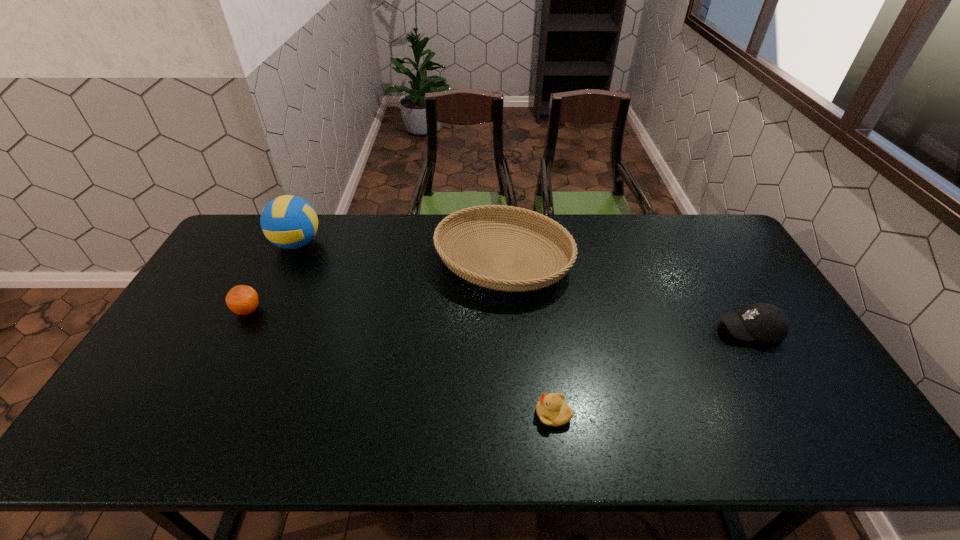
Identify the location of empty location between the tallest object and the orange. The width and height of the screenshot is (960, 540). (273, 277).

Locate an element on the screen. This screenshot has height=540, width=960. free space between the orange and the shortest object is located at coordinates (400, 362).

Where is `free point between the tallest object and the orange`? The height and width of the screenshot is (540, 960). free point between the tallest object and the orange is located at coordinates (273, 277).

This screenshot has height=540, width=960. What are the coordinates of `free spot between the baseball cap and the duckling` in the screenshot? It's located at (651, 373).

The width and height of the screenshot is (960, 540). I want to click on free spot between the orange and the shortest object, so click(400, 362).

Where is `vacant space in between the basket and the baseball cap`? vacant space in between the basket and the baseball cap is located at coordinates (626, 296).

This screenshot has height=540, width=960. I want to click on object that stands as the fourth closest to the baseball cap, so click(x=243, y=300).

This screenshot has width=960, height=540. Identify the location of object that is the fourth nearest to the basket. (243, 300).